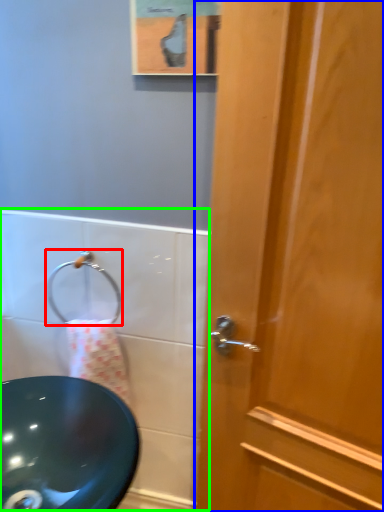
Question: Estimate the real-world distances between objects in this image. Which object is closer to shower (highlighted by a red box), door (highlighted by a blue box) or bath (highlighted by a green box)?

Choices:
 (A) door
 (B) bath

Answer: (B)